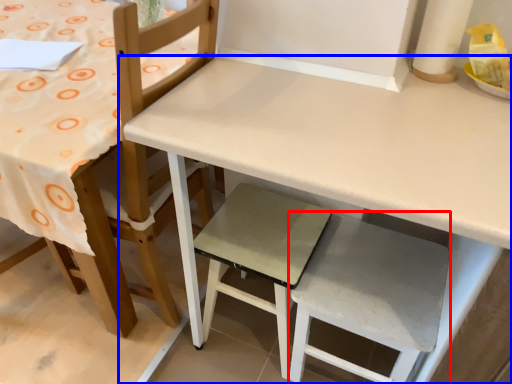
Question: Among these objects, which one is farthest to the camera, step stool (highlighted by a red box) or table (highlighted by a blue box)?

Choices:
 (A) step stool
 (B) table

Answer: (A)